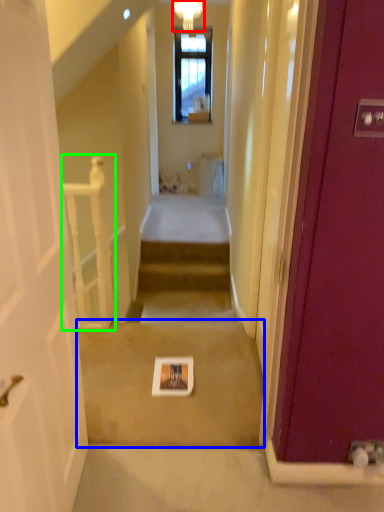
Question: Which is nearer to the light fixture (highlighted by a red box)? path (highlighted by a blue box) or balustrade (highlighted by a green box).

Choices:
 (A) path
 (B) balustrade

Answer: (B)